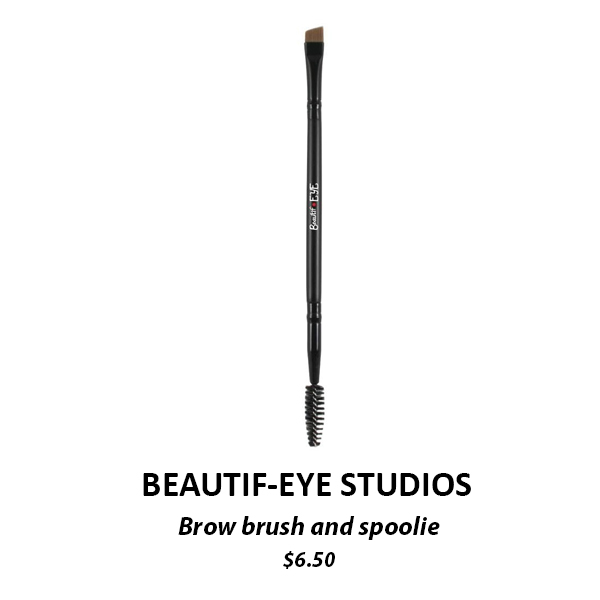
Where is `makeup brow brush`? makeup brow brush is located at coordinates (314, 287).